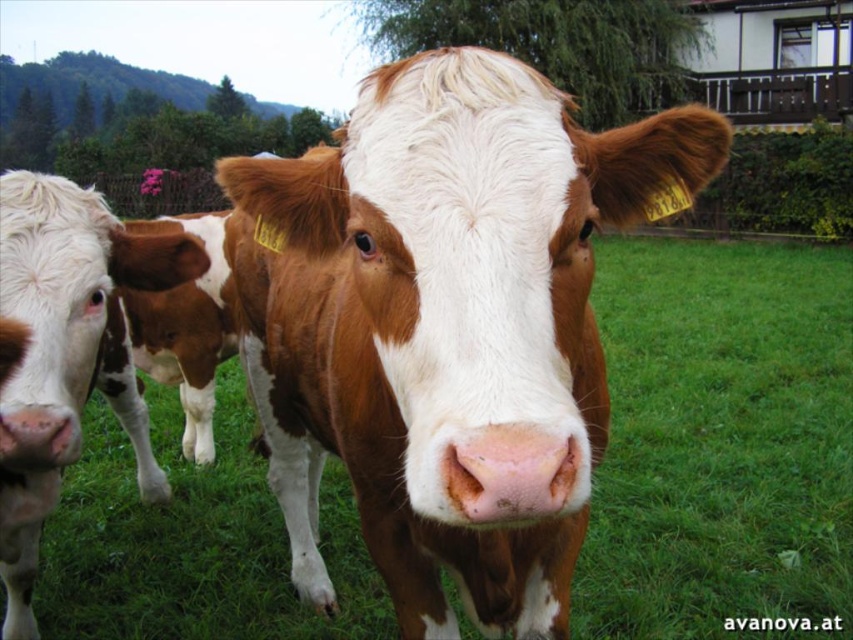
Which of these two, green grass at center or brown/white textured cow at center, stands taller?

Standing taller between the two is brown/white textured cow at center.

Who is more distant from viewer, (775, 444) or (0, 534)?

Point (775, 444)

The image size is (853, 640). Describe the element at coordinates (720, 442) in the screenshot. I see `green grass at center` at that location.

I want to click on green grass at center, so click(720, 442).

Who is lower down, brown/white fur at center or brown/white textured cow at center?

brown/white textured cow at center is below.

Is brown/white fur at center thinner than brown/white textured cow at center?

Incorrect, brown/white fur at center's width is not less than brown/white textured cow at center's.

Is point (252, 173) farther from camera compared to point (53, 212)?

That is False.

You are a GUI agent. You are given a task and a screenshot of the screen. Output one action in this format:
    pyautogui.click(x=<x>, y=<y>)
    Task: Click on the brown/white fur at center
    The width and height of the screenshot is (853, 640).
    Given the screenshot: What is the action you would take?
    pyautogui.click(x=445, y=324)

Which is above, green grass at center or brown/white textured cow at center-left?

brown/white textured cow at center-left is above.

Who is positioned more to the left, green grass at center or brown/white textured cow at center-left?

Positioned to the left is brown/white textured cow at center-left.

Between point (219, 576) and point (140, 333), which one is positioned behind?

The point (140, 333) is more distant.

The width and height of the screenshot is (853, 640). I want to click on green grass at center, so click(x=720, y=442).